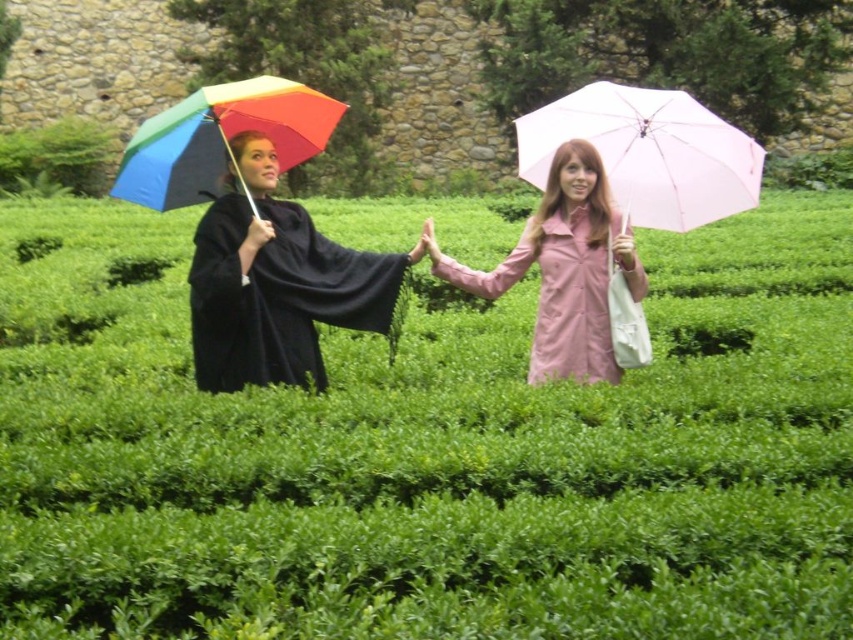
You are a fashion designer observing the two individuals in the garden. You notice both have a matte black cape at left and a black matte cape at left. Which one is layered on top?

The matte black cape at left is layered on top of the black matte cape at left.

You are a drone operator trying to capture a photo of the two points in the garden scene. The first point is at coordinates point [276,280] and the second point is at point [302,157]. From your current position, which point will appear closer to the camera?

Point [276,280] is in front of point [302,157], so it will appear closer to the camera.